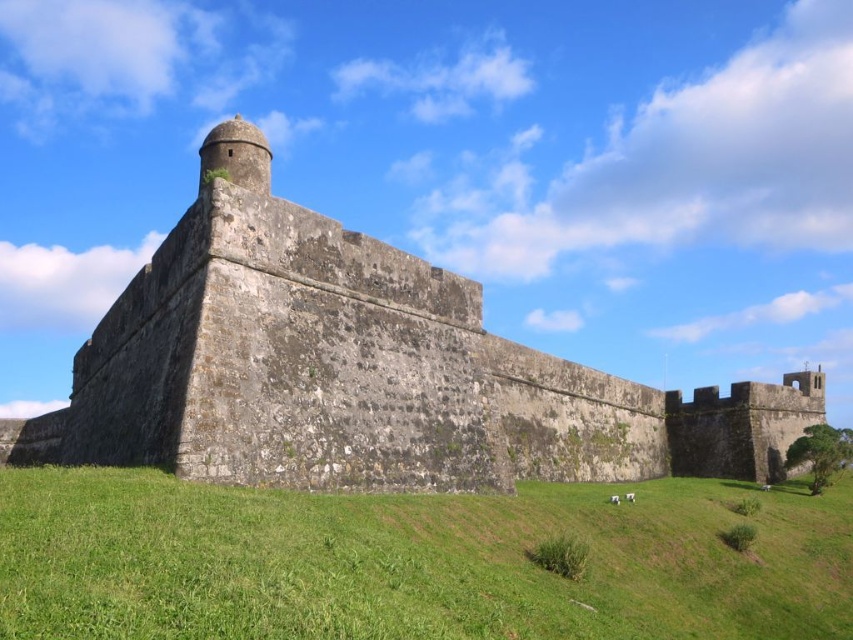
You are a gardener planning to plant flowers along the stone wall at center and the green grass at lower center. Based on their widths, which area would allow for a wider flower bed?

The stone wall at center might be wider than green grass at lower center, so the flower bed along the stone wall at center could potentially be wider.

You are standing in front of the stone wall at center and the green grass at lower center. Which one is higher in height?

The stone wall at center is taller than the green grass at lower center.

Based on the photo, you are a tourist standing in front of the stone wall at center and the green grass at lower center. Which object is bigger in size?

The stone wall at center has a larger size compared to the green grass at lower center, so the stone wall at center is bigger.